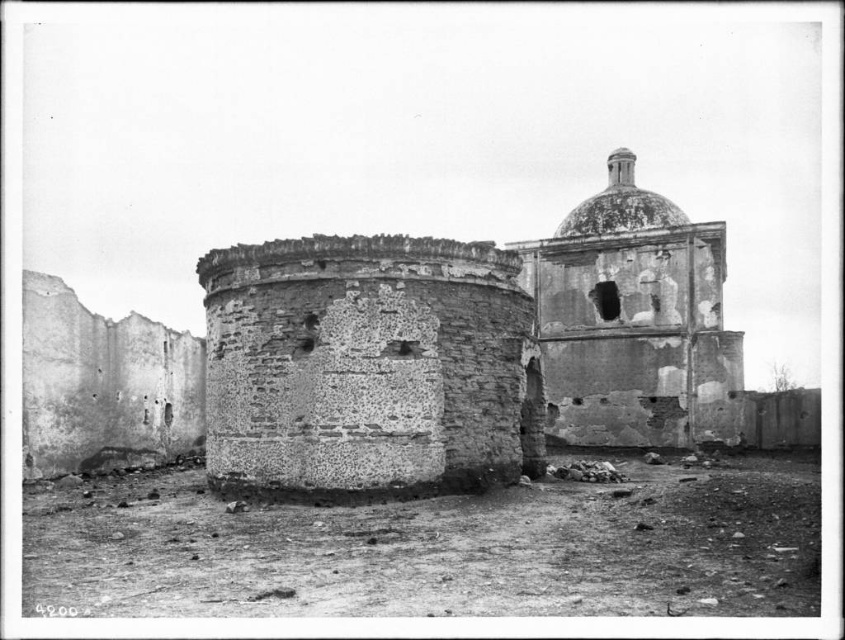
Does point (698, 312) lie in front of point (592, 209)?

That is True.

Between point (702, 292) and point (574, 216), which one is positioned behind?

The point (574, 216) is more distant.

At what (x,y) coordinates should I click in order to perform the action: click on rough stone dome at upper right. Please return your answer as a coordinate pair (x, y). The image size is (845, 640). Looking at the image, I should click on (633, 321).

Which of these two, rough stone wall at center or rough stone dome at upper right, stands shorter?

rough stone wall at center is shorter.

Is rough stone wall at center smaller than rough stone dome at upper right?

Indeed, rough stone wall at center has a smaller size compared to rough stone dome at upper right.

Is point (254, 445) positioned behind point (722, 276)?

No, (254, 445) is in front of (722, 276).

Identify the location of rough stone wall at center. The height and width of the screenshot is (640, 845). (368, 365).

The width and height of the screenshot is (845, 640). What do you see at coordinates (368, 365) in the screenshot?
I see `rough stone wall at center` at bounding box center [368, 365].

Describe the element at coordinates (368, 365) in the screenshot. Image resolution: width=845 pixels, height=640 pixels. I see `rough stone wall at center` at that location.

This screenshot has width=845, height=640. Identify the location of rough stone wall at center. (368, 365).